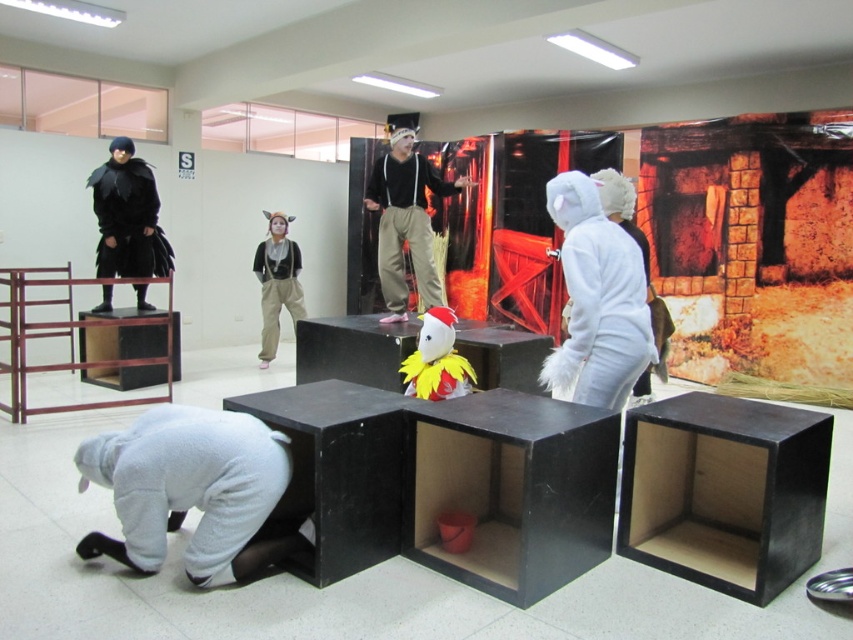
Question: Estimate the real-world distances between objects in this image. Which object is closer to the black matte clothing at upper left?

Choices:
 (A) fluffy yellow and red costume at center
 (B) matte black outfit at center
 (C) matte black clown at center
 (D) white furry costume at right

Answer: (C)

Question: Does matte black clown at center have a lesser width compared to fluffy yellow and red costume at center?

Choices:
 (A) no
 (B) yes

Answer: (A)

Question: Which point is farther from the camera taking this photo?

Choices:
 (A) (416, 230)
 (B) (590, 288)
 (C) (444, 385)
 (D) (260, 339)

Answer: (D)

Question: Where is gray fleece costume at lower left located in relation to black matte clothing at upper left in the image?

Choices:
 (A) below
 (B) above

Answer: (A)

Question: Among these objects, which one is farthest from the camera?

Choices:
 (A) white furry costume at right
 (B) gray fleece costume at lower left
 (C) matte black outfit at center
 (D) fluffy yellow and red costume at center

Answer: (C)

Question: Does black matte clothing at upper left lie behind matte black clown at center?

Choices:
 (A) no
 (B) yes

Answer: (A)